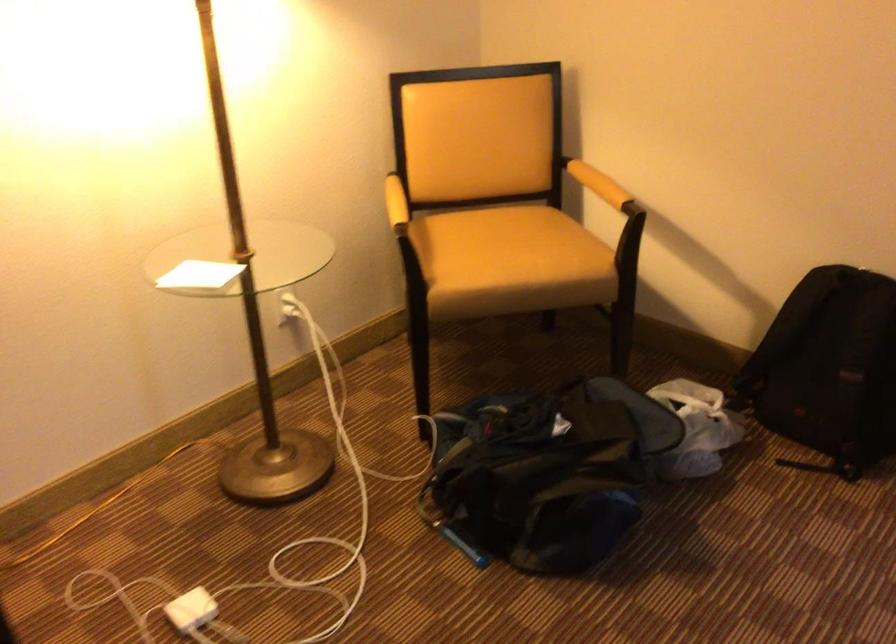
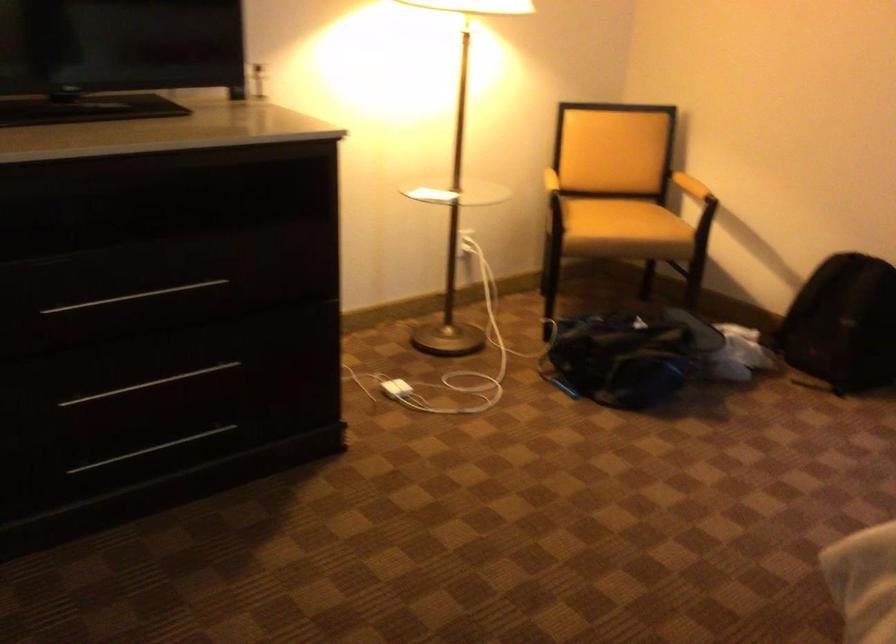
Locate, in the second image, the point that corresponds to (x=521, y=260) in the first image.

(623, 220)